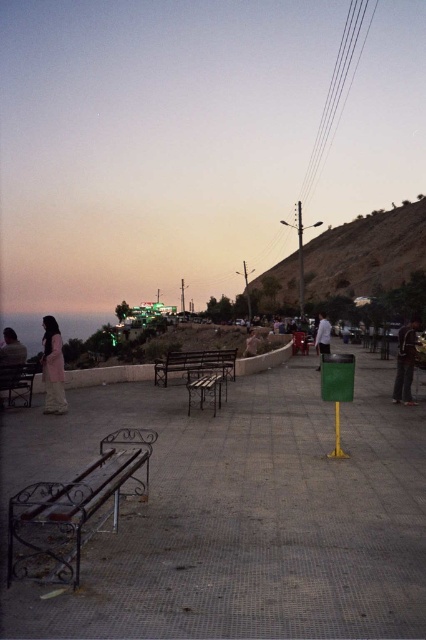
Who is more distant from viewer, (134, 408) or (256, 344)?

The point (256, 344) is more distant.

Does metal bench at center have a larger size compared to light brown leather jacket at center?

No, metal bench at center is not bigger than light brown leather jacket at center.

Which is behind, point (376, 580) or point (253, 342)?

Positioned behind is point (253, 342).

I want to click on metal bench at center, so click(x=241, y=513).

Describe the element at coordinates (74, 508) in the screenshot. The width and height of the screenshot is (426, 640). I see `black wrought iron bench at lower left` at that location.

Between point (65, 547) and point (411, 349), which one is positioned behind?

Positioned behind is point (411, 349).

Where is `black wrought iron bench at lower left`? This screenshot has width=426, height=640. black wrought iron bench at lower left is located at coordinates (74, 508).

Is point (45, 321) more distant than point (253, 355)?

No, (45, 321) is in front of (253, 355).

In the scene shown: Does pink fabric dress at left have a larger size compared to light brown leather jacket at center?

Correct, pink fabric dress at left is larger in size than light brown leather jacket at center.

Which is in front, point (63, 408) or point (253, 332)?

Positioned in front is point (63, 408).

The width and height of the screenshot is (426, 640). What are the coordinates of `pink fabric dress at left` in the screenshot? It's located at (52, 368).